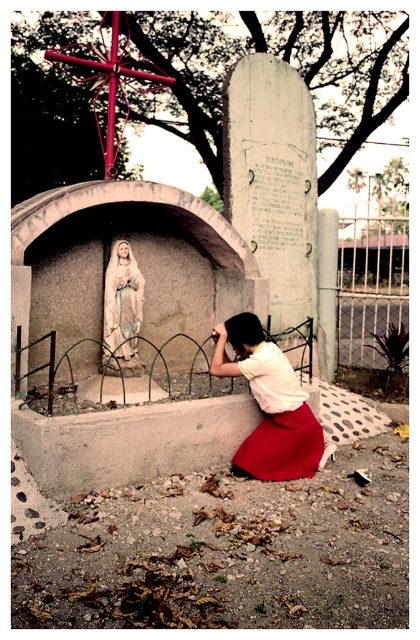
Question: Does smooth concrete base at lower center have a smaller size compared to white marble statue at center?

Choices:
 (A) no
 (B) yes

Answer: (A)

Question: Which object is closer to the camera taking this photo?

Choices:
 (A) white marble statue at center
 (B) matte white blouse at center

Answer: (B)

Question: Which is nearer to the white marble statue at center?

Choices:
 (A) matte white blouse at center
 (B) smooth concrete base at lower center

Answer: (A)

Question: Is smooth concrete base at lower center wider than matte white blouse at center?

Choices:
 (A) yes
 (B) no

Answer: (A)

Question: Is smooth concrete base at lower center behind white marble statue at center?

Choices:
 (A) yes
 (B) no

Answer: (B)

Question: Which point is closer to the camera?

Choices:
 (A) (385, 582)
 (B) (275, 387)

Answer: (A)